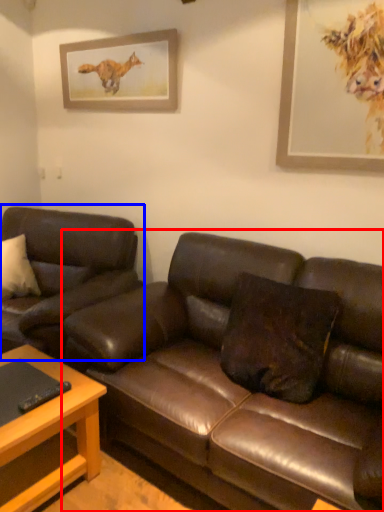
Question: Among these objects, which one is nearest to the camera, studio couch (highlighted by a red box) or studio couch (highlighted by a blue box)?

Choices:
 (A) studio couch
 (B) studio couch

Answer: (A)